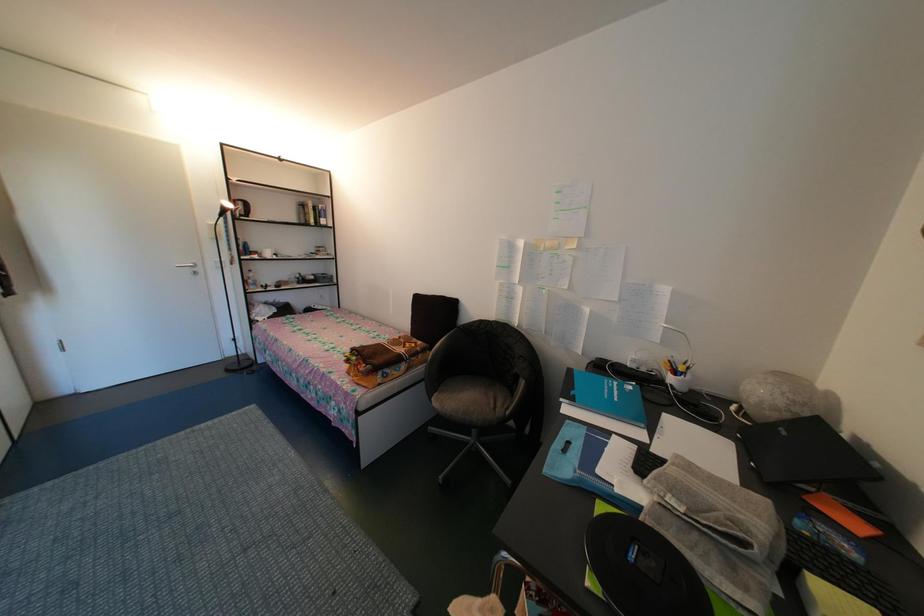
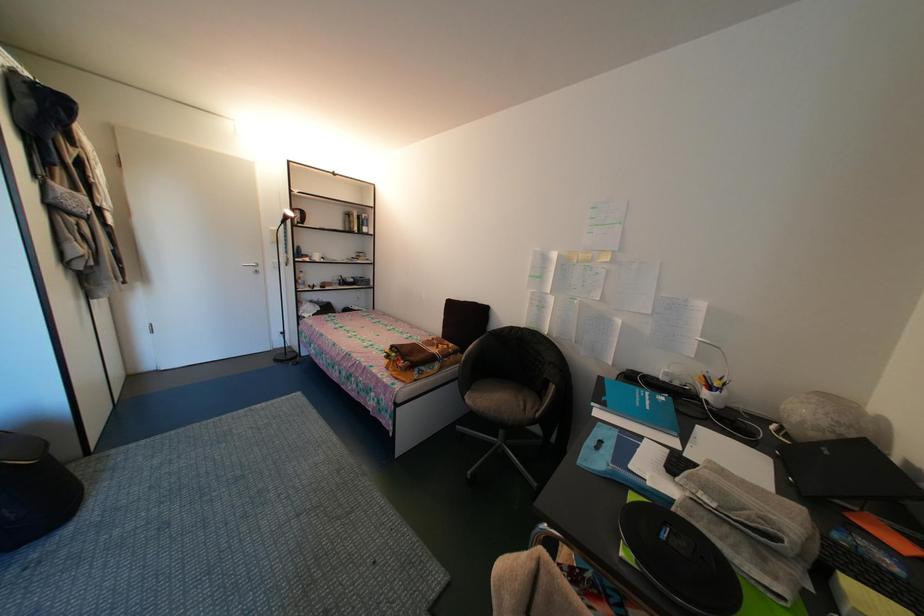
In a continuous first-person perspective shot, in which direction is the camera moving?

The cameraman walked toward left, backward.